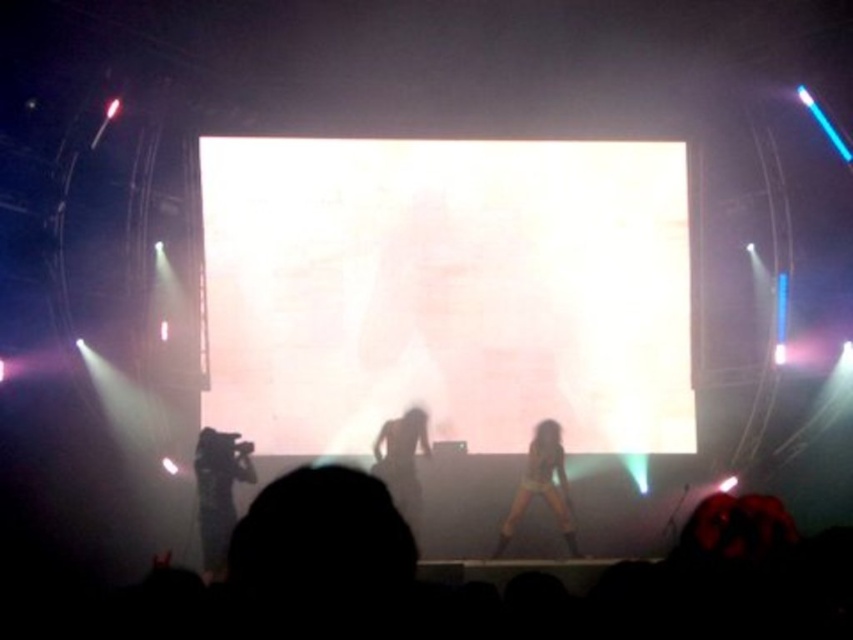
This screenshot has height=640, width=853. I want to click on bright white matte projection screen at center, so click(447, 291).

The width and height of the screenshot is (853, 640). I want to click on bright white matte projection screen at center, so click(447, 291).

Describe the element at coordinates (543, 486) in the screenshot. I see `skinny jeans at center` at that location.

Is point (558, 509) in front of point (386, 440)?

Yes.

At what (x,y) coordinates should I click in order to perform the action: click on skinny jeans at center. Please return your answer as a coordinate pair (x, y). This screenshot has width=853, height=640. Looking at the image, I should click on (543, 486).

Between dark fabric camera at lower left and skinny jeans at center, which one is positioned lower?

dark fabric camera at lower left is lower down.

Between point (221, 552) and point (537, 474), which one is positioned in front?

Point (221, 552) is in front.

Locate an element on the screen. The width and height of the screenshot is (853, 640). dark fabric camera at lower left is located at coordinates click(218, 492).